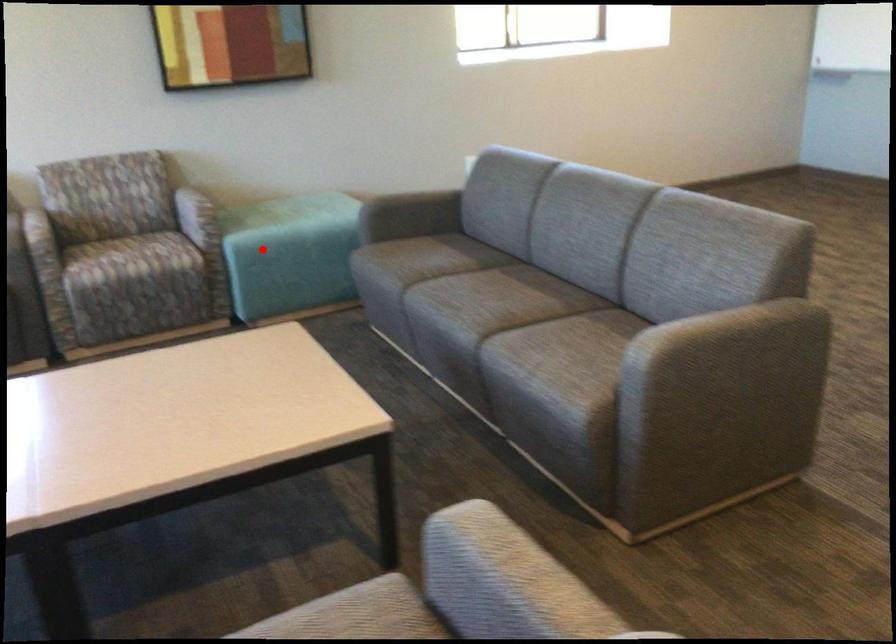
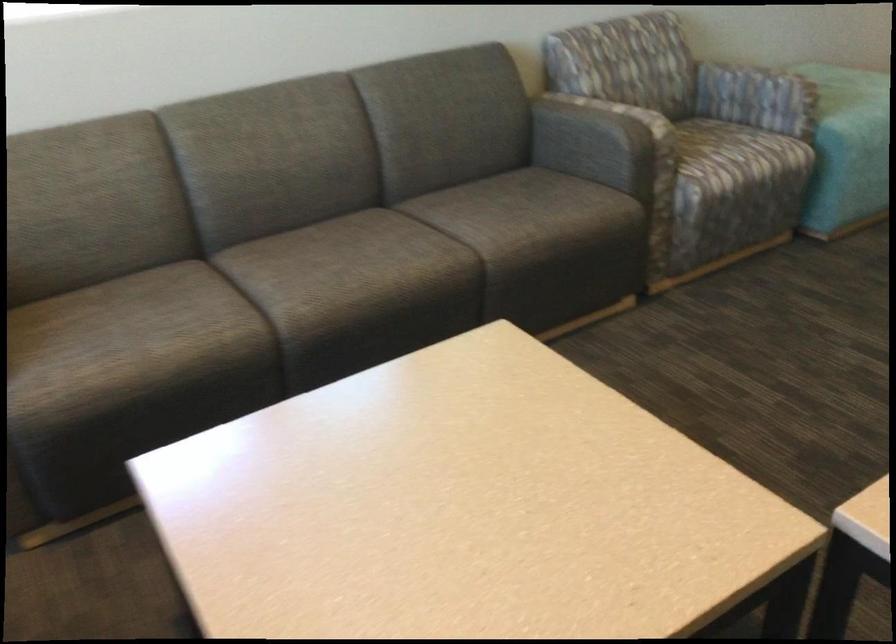
In the second image, find the point that corresponds to the highlighted location in the first image.

(854, 129)